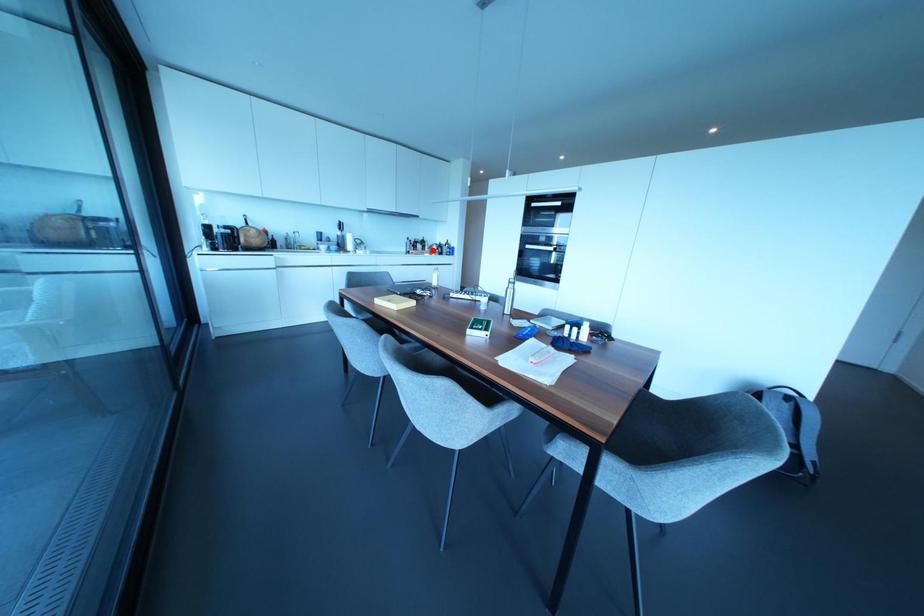
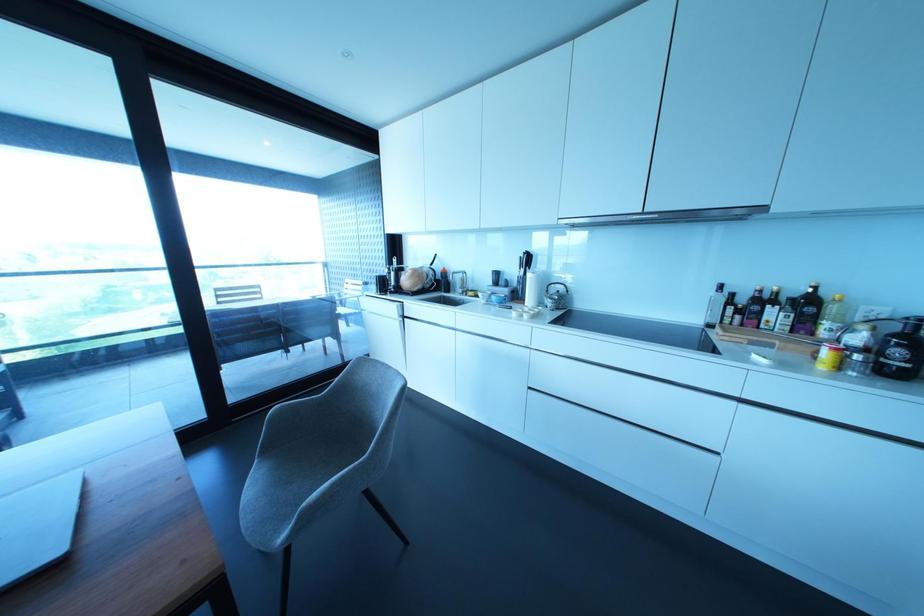
The point at the highlighted location is marked in the first image. Where is the corresponding point in the second image?

(825, 353)